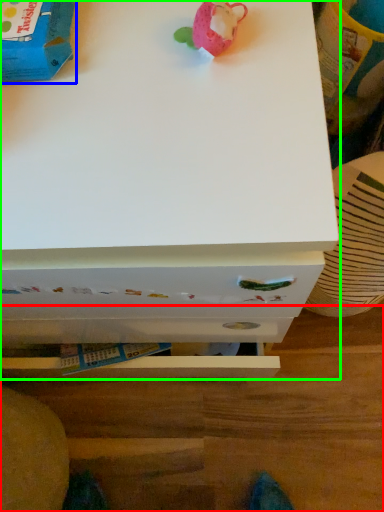
Question: Which object is the farthest from table (highlighted by a red box)? Choose among these: toy (highlighted by a blue box) or chest of drawers (highlighted by a green box).

Choices:
 (A) toy
 (B) chest of drawers

Answer: (A)